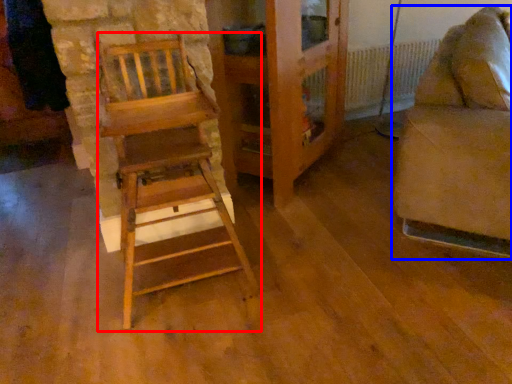
Question: Which object appears farthest to the camera in this image, furniture (highlighted by a red box) or furniture (highlighted by a blue box)?

Choices:
 (A) furniture
 (B) furniture

Answer: (B)